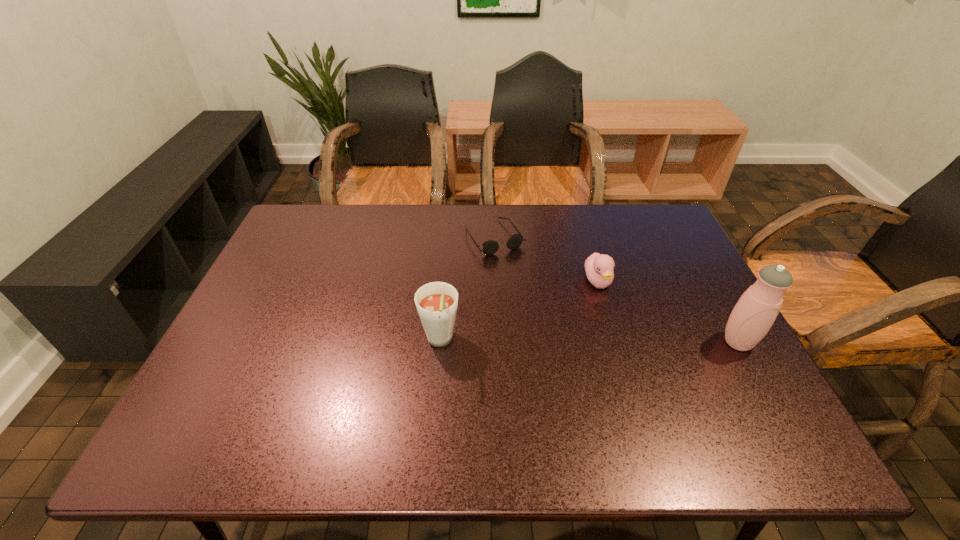
The image size is (960, 540). I want to click on vacant space on the desktop that is between the third shortest object and the thermos bottle and is positioned on the front-facing side of the sunglasses, so click(568, 342).

Where is `vacant space on the desktop that is between the root beer and the thermos bottle and is positioned on the front-facing side of the duckling`? vacant space on the desktop that is between the root beer and the thermos bottle and is positioned on the front-facing side of the duckling is located at coordinates (633, 342).